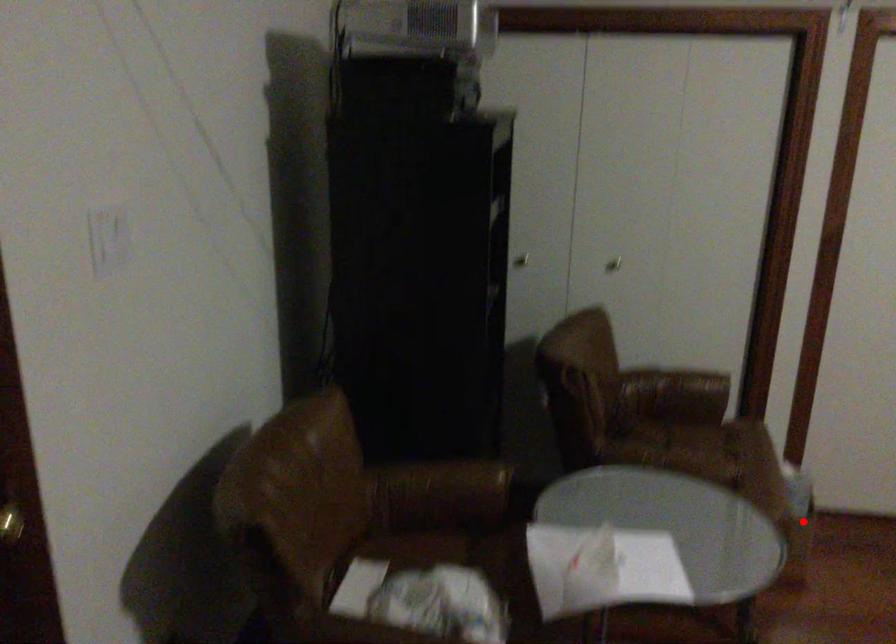
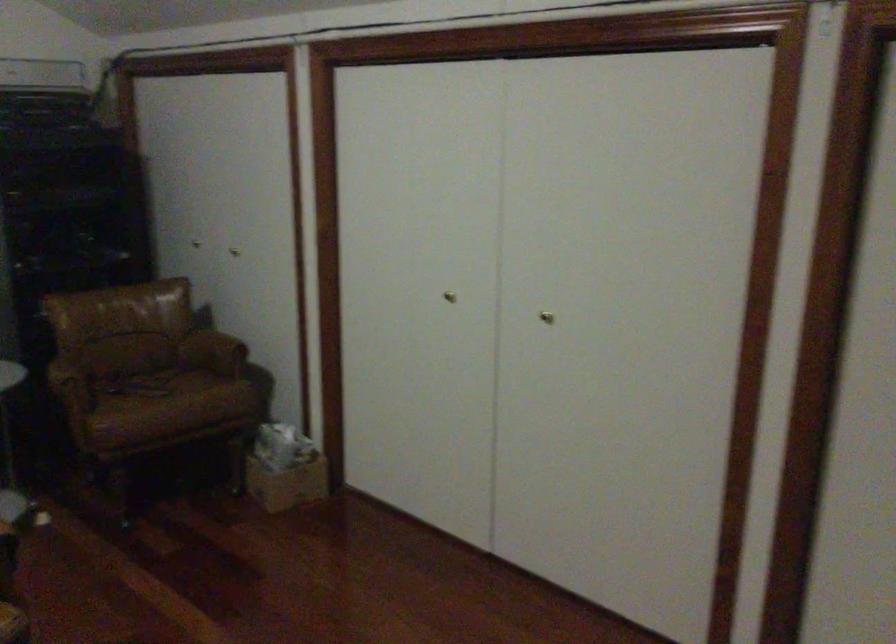
Question: I am providing you with two images of the same scene from different viewpoints. In image1, a red point is highlighted. Considering the same 3D point in image2, which of the following is correct?

Choices:
 (A) It is closer
 (B) It is farther

Answer: (B)